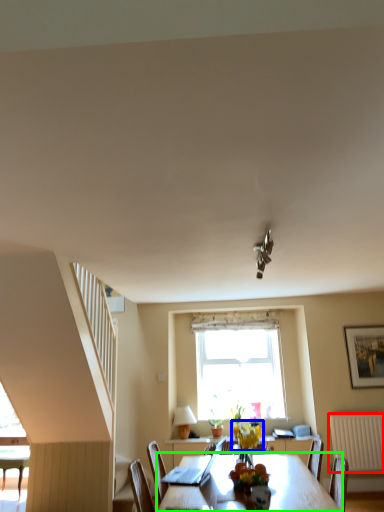
Question: Considering the real-world distances, which object is farthest from radiator (highlighted by a red box)? flower (highlighted by a blue box) or table (highlighted by a green box)?

Choices:
 (A) flower
 (B) table

Answer: (B)